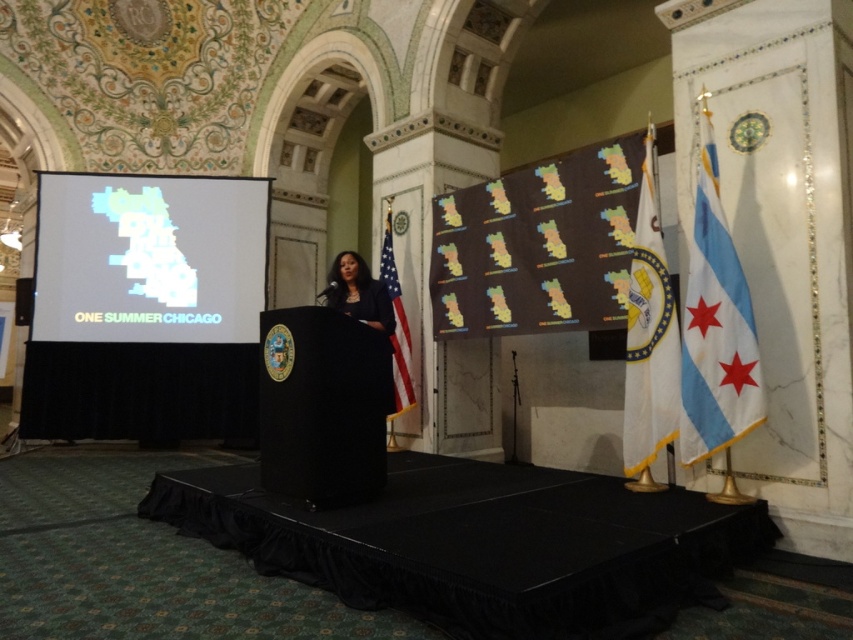
You are an event organizer setting up for a presentation. You have a translucent plastic map at left and a black fabric at center. Which object is wider?

The translucent plastic map at left is wider than the black fabric at center.

You are sitting in the audience facing the stage. There are two points marked on the screen. The first point is at coordinates point (141, 195) and the second point is at point (341, 252). Which point is closer to you?

Point (141, 195) is in front of point (341, 252), so it is closer to you.

You are a stagehand setting up for a presentation. The translucent plastic map at left and the american flag at center must be spaced exactly 10 feet apart for proper camera framing. Are they currently positioned correctly?

The translucent plastic map at left and the american flag at center are currently 9.35 feet apart, which is less than the required 10 feet. They need to be moved further apart to meet the spacing requirement.